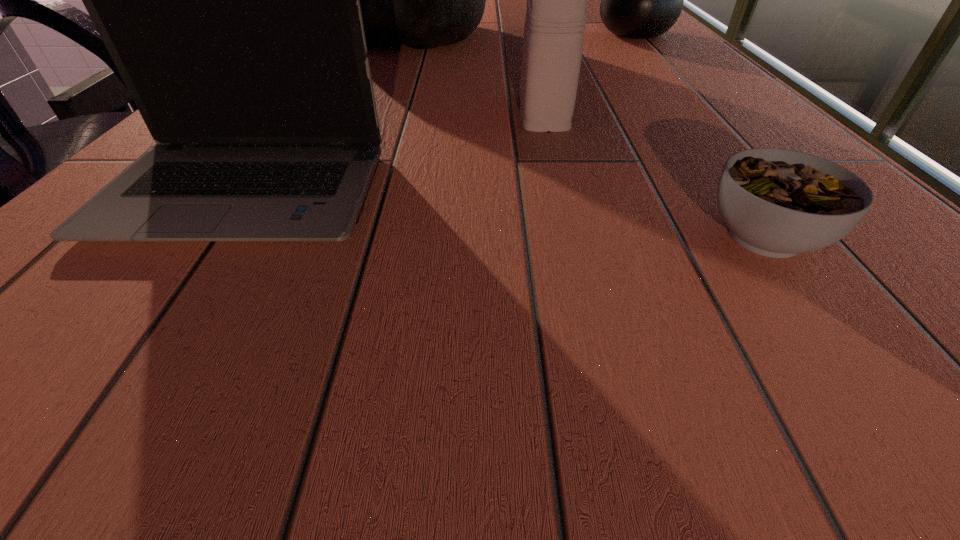
I want to click on vacant region located on the handle side of the third object from left to right, so click(x=529, y=57).

The height and width of the screenshot is (540, 960). I want to click on free space located 0.160m on the screen of the laptop computer, so click(x=108, y=386).

The height and width of the screenshot is (540, 960). What are the coordinates of `vacant space located 0.310m on the left of the shortest object` in the screenshot? It's located at (415, 237).

The image size is (960, 540). Identify the location of plastic bag at the left edge. (423, 0).

Identify the location of laptop computer located in the left edge section of the desktop. (229, 0).

In order to click on vase at the right edge in this screenshot , I will do `click(639, 0)`.

What are the coordinates of `soup bowl that is at the right edge` in the screenshot? It's located at (777, 203).

This screenshot has height=540, width=960. In the image, there is a desktop. Identify the location of vacant space at the near edge. (481, 378).

In the image, there is a desktop. At what (x,y) coordinates should I click in order to perform the action: click on free space at the right edge. Please return your answer as a coordinate pair (x, y). Image resolution: width=960 pixels, height=540 pixels. Looking at the image, I should click on (693, 147).

Find the location of `vacant space at the near right corner of the desktop`. vacant space at the near right corner of the desktop is located at coordinates (948, 426).